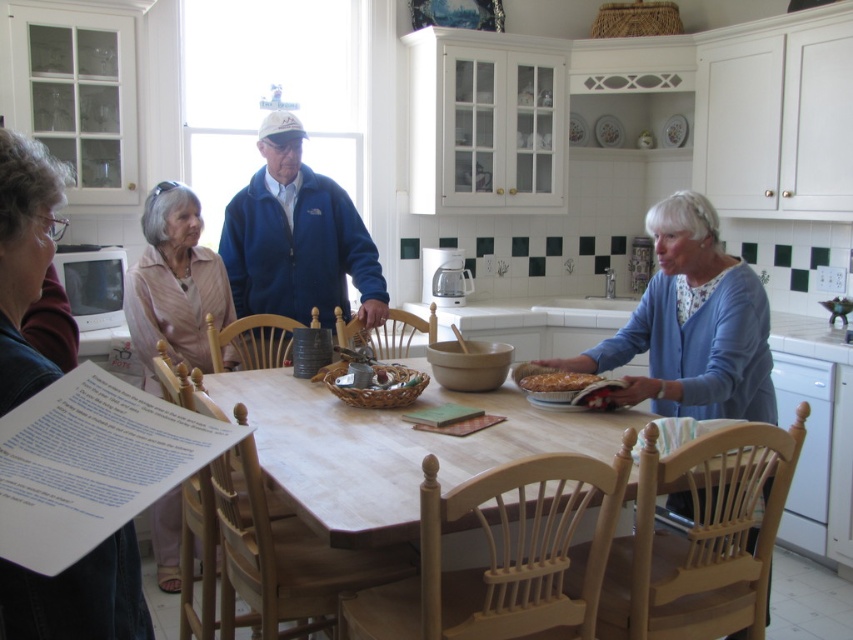
Question: Does blue fabric jacket at center have a lesser width compared to blue fleece jacket at center?

Choices:
 (A) yes
 (B) no

Answer: (A)

Question: Which is nearer to the blue cotton sweater at center?

Choices:
 (A) blue fleece jacket at center
 (B) golden flaky pastry at center
 (C) light pink fabric jacket at upper left
 (D) gray hair at upper left

Answer: (B)

Question: Which object appears farthest from the camera in this image?

Choices:
 (A) blue fleece jacket at center
 (B) blue fabric jacket at center
 (C) light pink fabric jacket at upper left
 (D) golden flaky pastry at center

Answer: (A)

Question: Can you confirm if gray hair at upper left is positioned to the left of golden flaky pastry at center?

Choices:
 (A) yes
 (B) no

Answer: (A)

Question: Based on their relative distances, which object is nearer to the blue fleece jacket at center?

Choices:
 (A) light brown wooden table at center
 (B) light pink fabric jacket at upper left

Answer: (B)

Question: Can you confirm if blue cotton sweater at center is positioned to the right of blue fabric jacket at center?

Choices:
 (A) yes
 (B) no

Answer: (A)